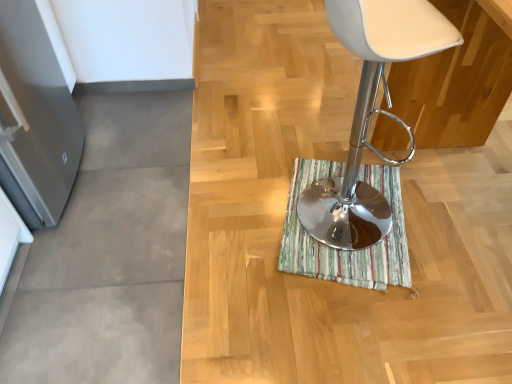
This screenshot has width=512, height=384. Describe the element at coordinates (370, 112) in the screenshot. I see `white plastic stool at center` at that location.

Where is `white plastic stool at center`? white plastic stool at center is located at coordinates (370, 112).

This screenshot has height=384, width=512. What do you see at coordinates (346, 250) in the screenshot? I see `striped fabric bath mat at center` at bounding box center [346, 250].

Find the location of a particular element. This screenshot has height=384, width=512. striped fabric bath mat at center is located at coordinates (346, 250).

Measure the distance between striped fabric bath mat at center and camera.

The depth of striped fabric bath mat at center is 1.52 meters.

At what (x,y) coordinates should I click in order to perform the action: click on white plastic stool at center. Please return your answer as a coordinate pair (x, y). Looking at the image, I should click on (370, 112).

Is white plastic stool at center to the right of striped fabric bath mat at center from the viewer's perspective?

In fact, white plastic stool at center is to the left of striped fabric bath mat at center.

Between white plastic stool at center and striped fabric bath mat at center, which one is positioned in front?

white plastic stool at center is closer to the camera.

Which point is more distant from viewer, (370, 17) or (392, 278)?

Point (392, 278)

From the image's perspective, between white plastic stool at center and striped fabric bath mat at center, which one is located above?

From the image's view, white plastic stool at center is above.

From a real-world perspective, between white plastic stool at center and striped fabric bath mat at center, who is vertically lower?

striped fabric bath mat at center is physically lower.

Which of these two, white plastic stool at center or striped fabric bath mat at center, is thinner?

With smaller width is white plastic stool at center.

Which of these two, white plastic stool at center or striped fabric bath mat at center, stands taller?

white plastic stool at center is taller.

Considering the sizes of white plastic stool at center and striped fabric bath mat at center in the image, is white plastic stool at center bigger or smaller than striped fabric bath mat at center?

Considering their sizes, white plastic stool at center takes up more space than striped fabric bath mat at center.

Is striped fabric bath mat at center completely or partially inside white plastic stool at center?

No, striped fabric bath mat at center is not a part of white plastic stool at center.

Is white plastic stool at center not close to striped fabric bath mat at center?

No, white plastic stool at center is not far away from striped fabric bath mat at center.

Looking at this image, is white plastic stool at center turned away from striped fabric bath mat at center?

That's not correct — white plastic stool at center is not looking away from striped fabric bath mat at center.

This screenshot has width=512, height=384. Identify the location of chair on the left of the striped fabric bath mat at center. [x=370, y=112].

Based on the photo, considering the relative positions of striped fabric bath mat at center and white plastic stool at center in the image provided, is striped fabric bath mat at center to the left or to the right of white plastic stool at center?

Clearly, striped fabric bath mat at center is on the right of white plastic stool at center in the image.

Between striped fabric bath mat at center and white plastic stool at center, which one is positioned behind?

striped fabric bath mat at center.

Considering the positions of point (374, 286) and point (356, 185), is point (374, 286) closer or farther from the camera than point (356, 185)?

Point (374, 286) appears to be closer to the viewer than point (356, 185).

From the image's perspective, would you say striped fabric bath mat at center is positioned over white plastic stool at center?

Actually, striped fabric bath mat at center appears below white plastic stool at center in the image.

From a real-world perspective, relative to white plastic stool at center, is striped fabric bath mat at center vertically above or below?

striped fabric bath mat at center is situated lower than white plastic stool at center in the real world.

Can you confirm if striped fabric bath mat at center is thinner than white plastic stool at center?

No, striped fabric bath mat at center is not thinner than white plastic stool at center.

Considering the relative sizes of striped fabric bath mat at center and white plastic stool at center in the image provided, is striped fabric bath mat at center shorter than white plastic stool at center?

Yes.

From the picture: Which of these two, striped fabric bath mat at center or white plastic stool at center, is smaller?

Smaller between the two is striped fabric bath mat at center.

Is striped fabric bath mat at center not inside white plastic stool at center?

striped fabric bath mat at center lies outside white plastic stool at center's area.

Consider the image. Is striped fabric bath mat at center not near white plastic stool at center?

They are positioned close to each other.

Is striped fabric bath mat at center looking in the opposite direction of white plastic stool at center?

No, white plastic stool at center is not at the back of striped fabric bath mat at center.

How many degrees apart are the facing directions of striped fabric bath mat at center and white plastic stool at center?

The angular difference between striped fabric bath mat at center and white plastic stool at center is 26.5 degrees.

The height and width of the screenshot is (384, 512). What are the coordinates of `bath mat lying below the white plastic stool at center (from the image's perspective)` in the screenshot? It's located at tap(346, 250).

Locate an element on the screen. The image size is (512, 384). bath mat below the white plastic stool at center (from a real-world perspective) is located at coordinates (346, 250).

In the image, there is a striped fabric bath mat at center. Where is `chair above it (from the image's perspective)`? The image size is (512, 384). chair above it (from the image's perspective) is located at coordinates (370, 112).